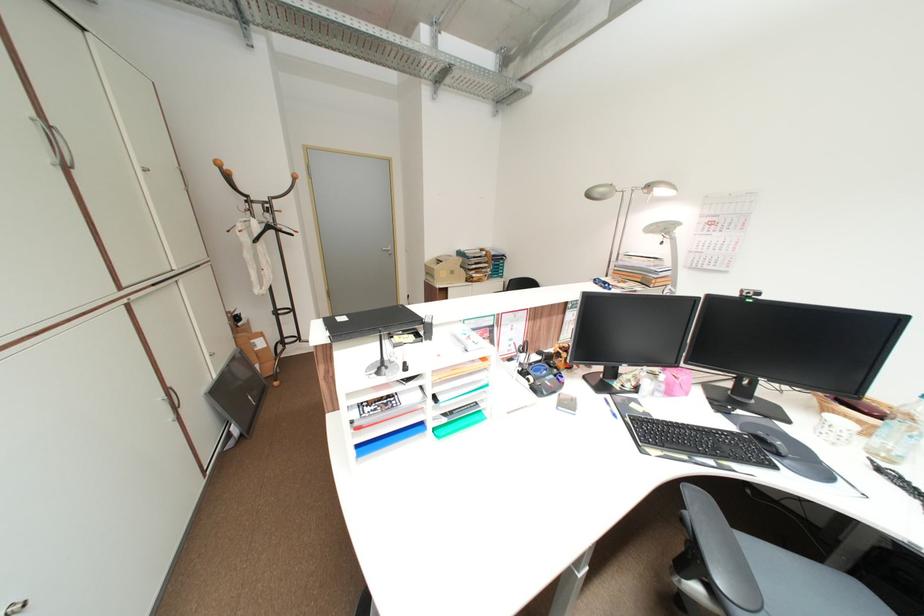
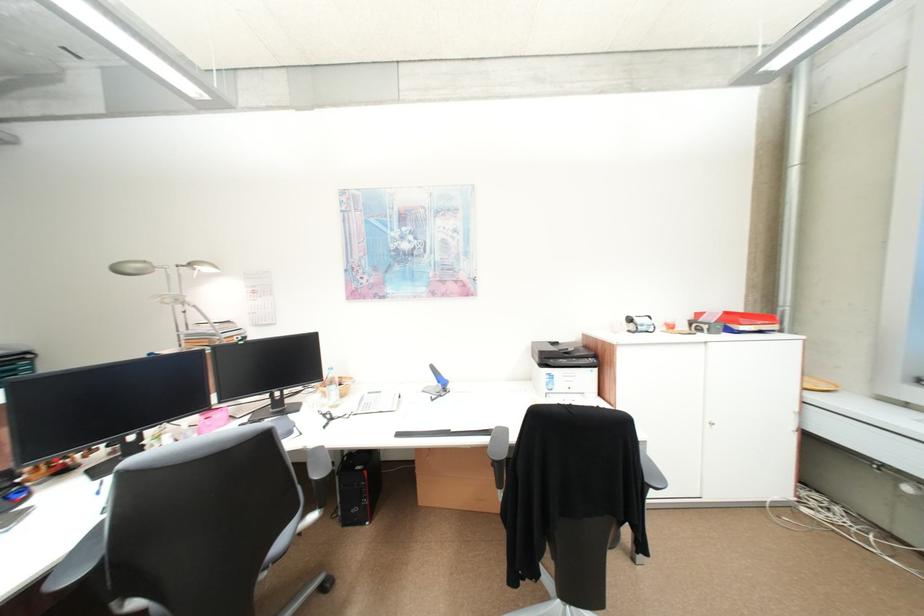
Locate, in the second image, the point that corresponds to (x=599, y=197) in the first image.

(127, 272)